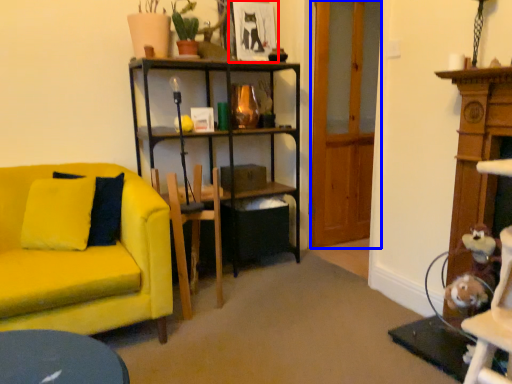
Question: Among these objects, which one is farthest to the camera, picture frame (highlighted by a red box) or glass door (highlighted by a blue box)?

Choices:
 (A) picture frame
 (B) glass door

Answer: (A)